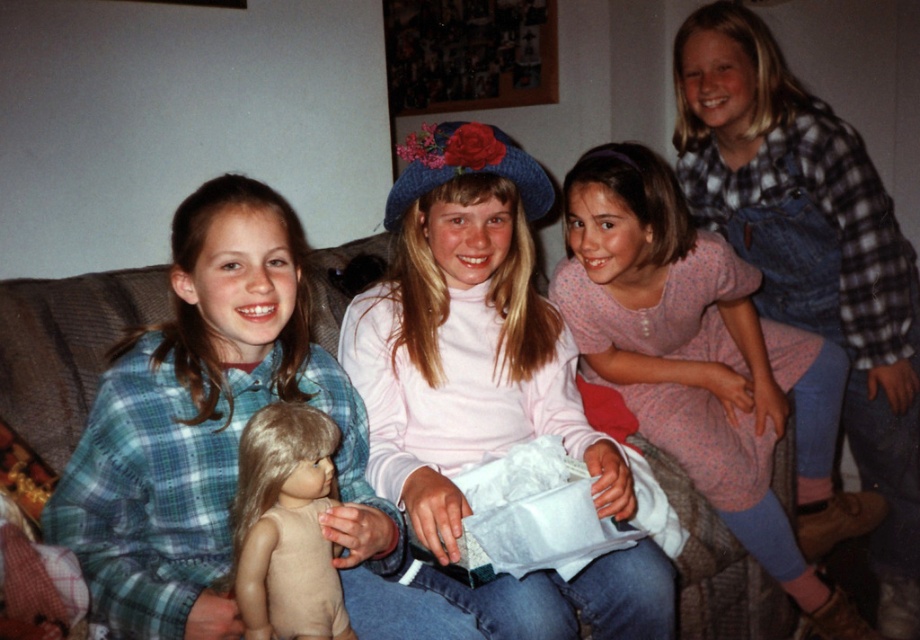
Question: Is pink dotted dress at center smaller than smooth beige doll at center?

Choices:
 (A) yes
 (B) no

Answer: (B)

Question: Which point is closer to the camera?

Choices:
 (A) matte plaid shirt at left
 (B) pink dotted dress at center
 (C) smooth beige doll at center
 (D) matte pink turtleneck at center

Answer: (C)

Question: From the image, what is the correct spatial relationship of matte pink turtleneck at center in relation to matte plaid shirt at left?

Choices:
 (A) below
 (B) above

Answer: (B)

Question: Is pink dotted dress at center to the left of smooth beige doll at center from the viewer's perspective?

Choices:
 (A) yes
 (B) no

Answer: (B)

Question: Which of the following is the farthest from the observer?

Choices:
 (A) (647, 396)
 (B) (306, 314)

Answer: (A)

Question: Which point is farther to the camera?

Choices:
 (A) matte pink turtleneck at center
 (B) pink dotted dress at center
 (C) matte plaid shirt at left
 (D) smooth beige doll at center

Answer: (B)